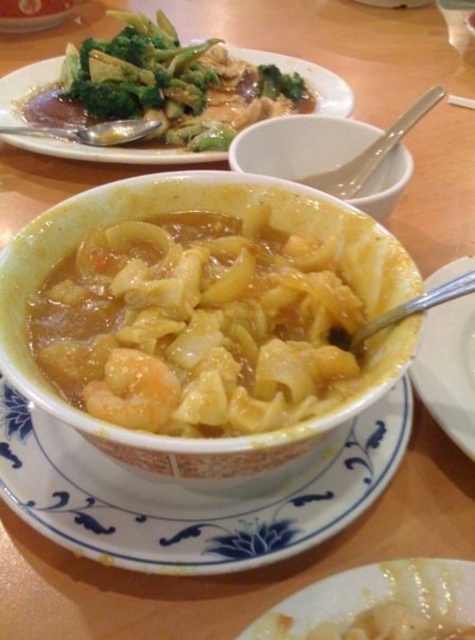
Question: Is white glossy bowl at center wider than white ceramic bowl at center?

Choices:
 (A) no
 (B) yes

Answer: (B)

Question: Which point is closer to the camera?

Choices:
 (A) white glossy bowl at center
 (B) green matte broccoli at upper center
 (C) green leafy vegetables at upper left

Answer: (A)

Question: Does white glossy bowl at center appear on the right side of green matte broccoli at upper center?

Choices:
 (A) no
 (B) yes

Answer: (A)

Question: Does white matte bowl at center have a greater width compared to green leafy vegetables at upper left?

Choices:
 (A) yes
 (B) no

Answer: (B)

Question: Which point appears farthest from the camera in this image?

Choices:
 (A) (294, 92)
 (B) (364, 188)

Answer: (A)

Question: Which point is farther to the camera?

Choices:
 (A) (348, 97)
 (B) (257, 84)
 (C) (370, 179)

Answer: (B)